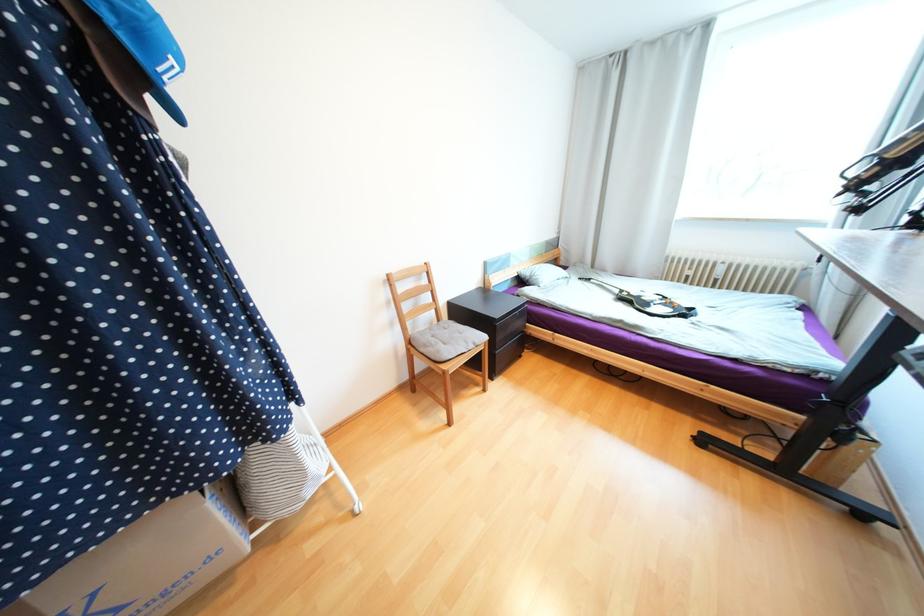
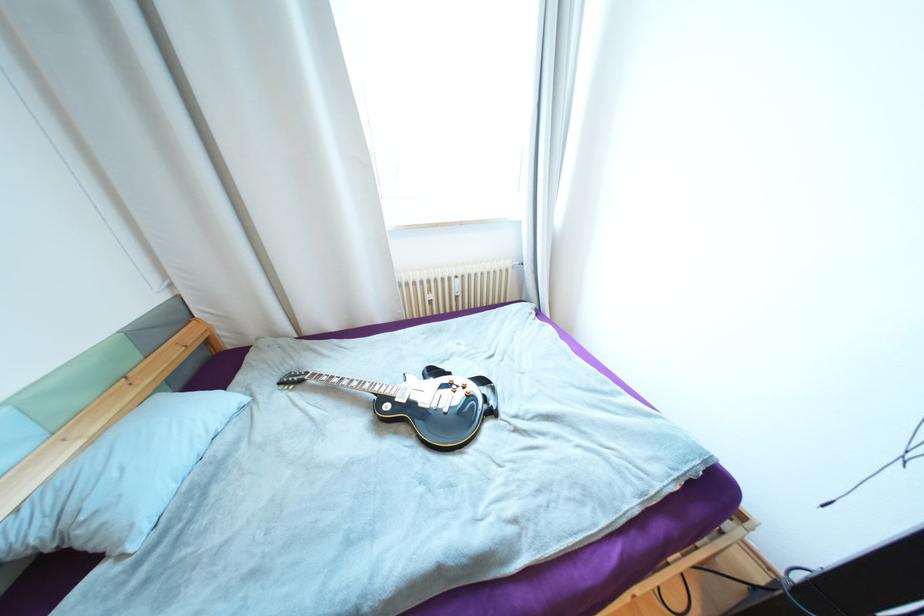
The point at (688, 315) is marked in the first image. Where is the corresponding point in the second image?

(497, 413)